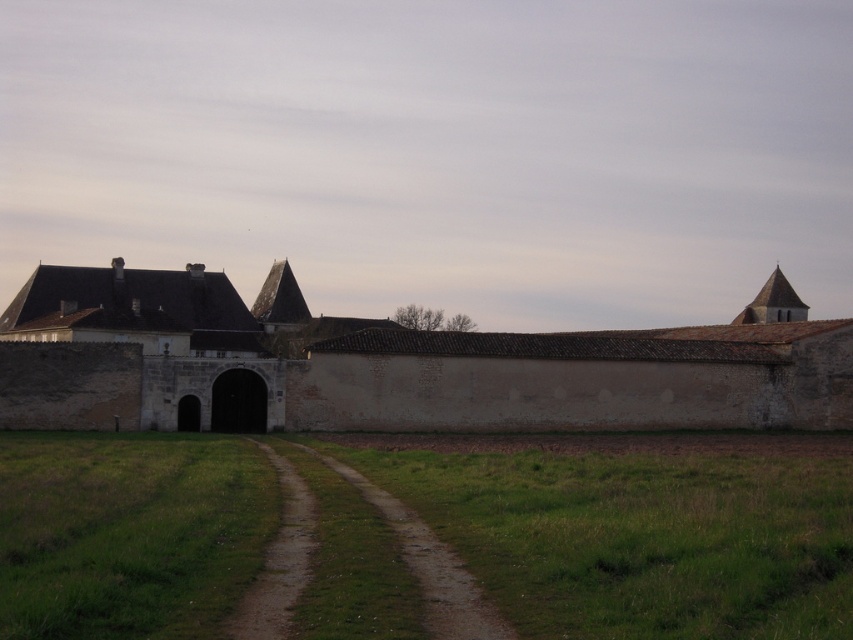
Who is positioned more to the right, brown stone wall at center or brown dirt track at center?

brown stone wall at center is more to the right.

Is brown stone wall at center bigger than brown dirt track at center?

Yes.

I want to click on brown stone wall at center, so click(418, 371).

Who is more distant from viewer, (387, 531) or (463, 625)?

Positioned behind is point (387, 531).

In the scene shown: Which is below, green grass at center or brown dirt track at center?

brown dirt track at center is below.

Does point (9, 627) lie in front of point (282, 548)?

Yes, point (9, 627) is closer to viewer.

The image size is (853, 640). Find the location of `green grass at center`. green grass at center is located at coordinates (640, 540).

Between green grass at center and brown stone wall at center, which one has less height?

green grass at center is shorter.

Between point (128, 554) and point (442, 376), which one is positioned in front?

Positioned in front is point (128, 554).

This screenshot has height=640, width=853. In order to click on green grass at center in this screenshot , I will do `click(640, 540)`.

Image resolution: width=853 pixels, height=640 pixels. What are the coordinates of `green grass at center` in the screenshot? It's located at (640, 540).